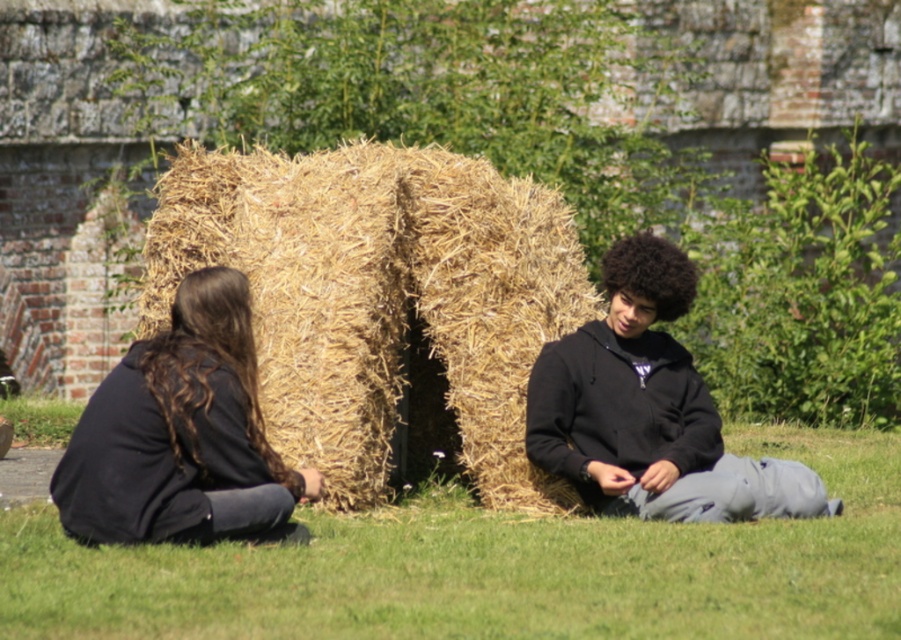
Is golden straw bale at center to the left of dark brown hair at left from the viewer's perspective?

In fact, golden straw bale at center is to the right of dark brown hair at left.

What do you see at coordinates (380, 298) in the screenshot? The image size is (901, 640). I see `golden straw bale at center` at bounding box center [380, 298].

Is point (272, 368) closer to camera compared to point (141, 460)?

No, it is not.

The height and width of the screenshot is (640, 901). I want to click on golden straw bale at center, so pyautogui.click(x=380, y=298).

Consider the image. Does green grass at lower center have a larger size compared to black matte hoodie at center?

Correct, green grass at lower center is larger in size than black matte hoodie at center.

This screenshot has height=640, width=901. What do you see at coordinates (492, 568) in the screenshot?
I see `green grass at lower center` at bounding box center [492, 568].

Locate an element on the screen. green grass at lower center is located at coordinates (492, 568).

Does point (435, 589) come farther from viewer compared to point (102, 445)?

No, (435, 589) is in front of (102, 445).

Is green grass at lower center smaller than dark brown hair at left?

Incorrect, green grass at lower center is not smaller in size than dark brown hair at left.

Measure the distance between point (405, 538) and camera.

Point (405, 538) is 43.53 meters away from camera.

Identify the location of green grass at lower center. The width and height of the screenshot is (901, 640). (492, 568).